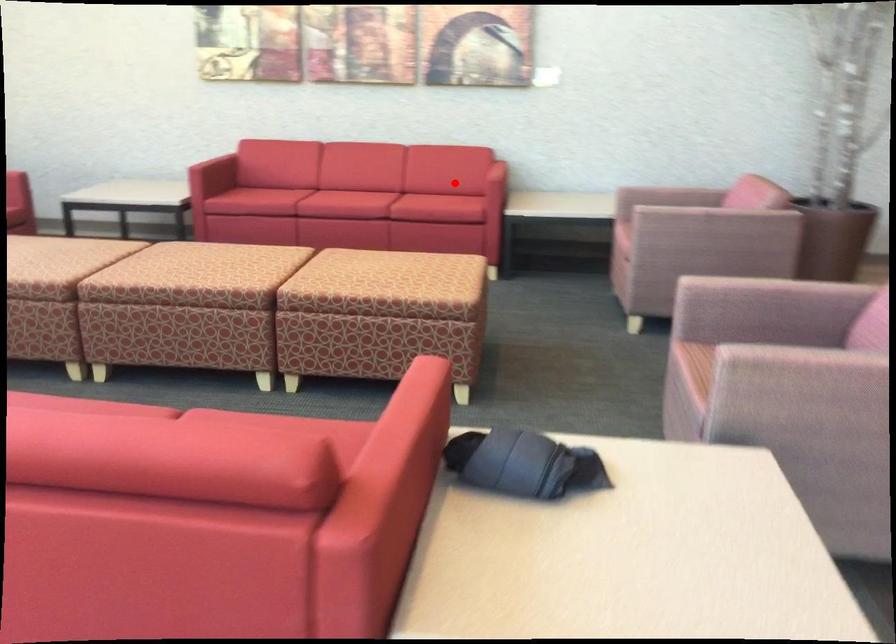
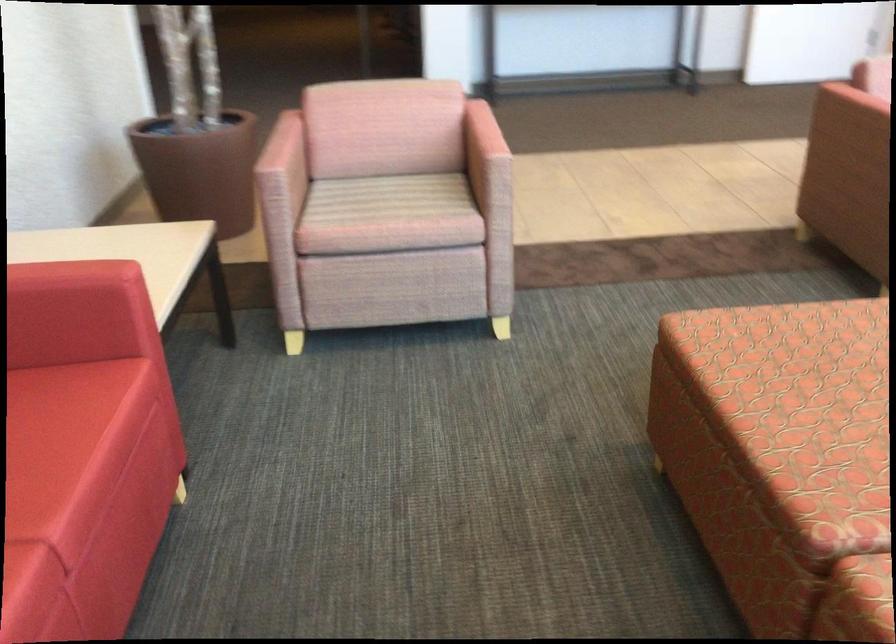
Where in the second image is the point corresponding to the highlighted location from the first image?

(38, 408)